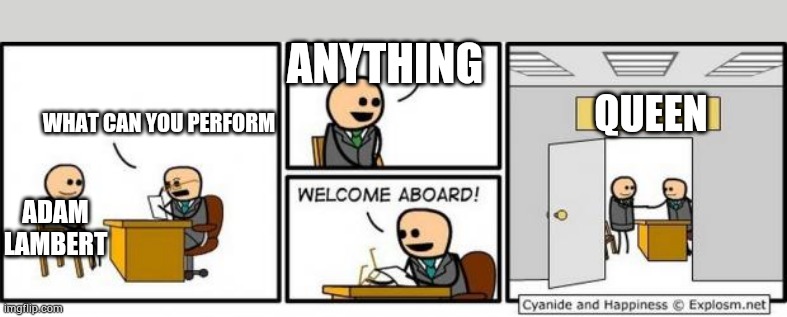
In order to click on door knob in this screenshot , I will do `click(560, 212)`.